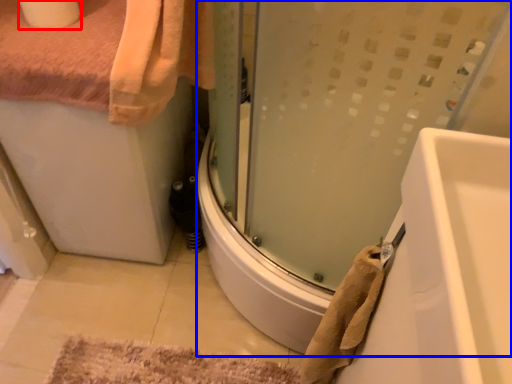
Question: Which point is further to the camera, toilet paper (highlighted by a red box) or shower door (highlighted by a blue box)?

Choices:
 (A) toilet paper
 (B) shower door

Answer: (A)